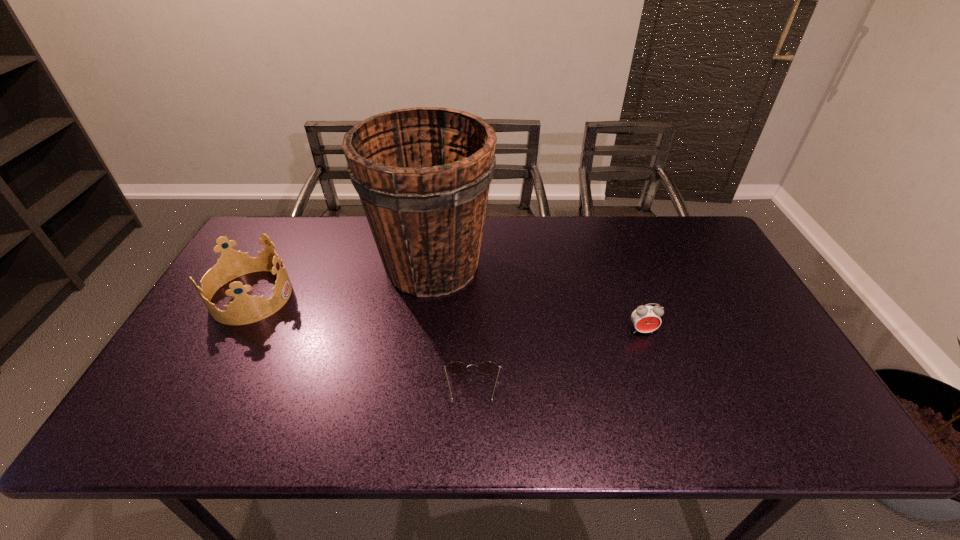
You are a GUI agent. You are given a task and a screenshot of the screen. Output one action in this format:
    pyautogui.click(x=<x>, y=<y>)
    Task: Click on the closest object to the leftmost object
    The width and height of the screenshot is (960, 540).
    Given the screenshot: What is the action you would take?
    pyautogui.click(x=423, y=174)

Where is `free space that satisfies the following two spatial constraints: 1. on the front side of the bucket; 2. on the front-facing side of the second tallest object`? The image size is (960, 540). free space that satisfies the following two spatial constraints: 1. on the front side of the bucket; 2. on the front-facing side of the second tallest object is located at coordinates (428, 296).